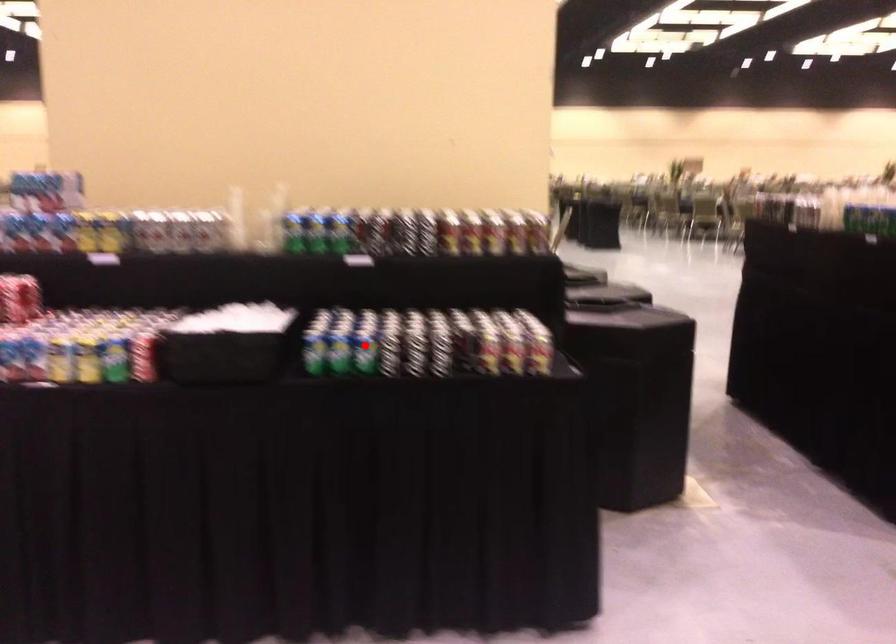
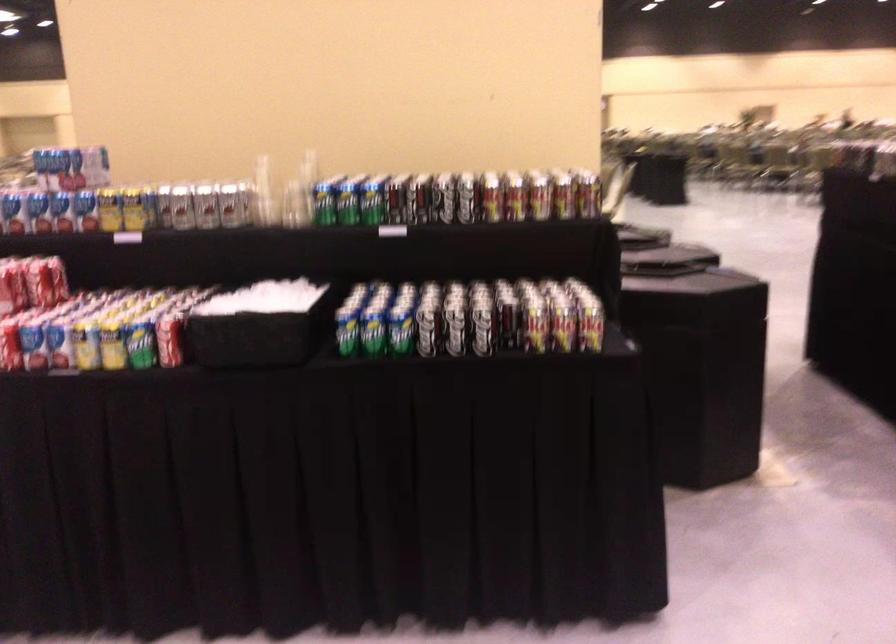
Question: I am providing you with two images of the same scene from different viewpoints. A red point is marked on the first image. At the location where the point appears in image 1, is it still visible in image 2?

Choices:
 (A) Yes
 (B) No

Answer: (A)